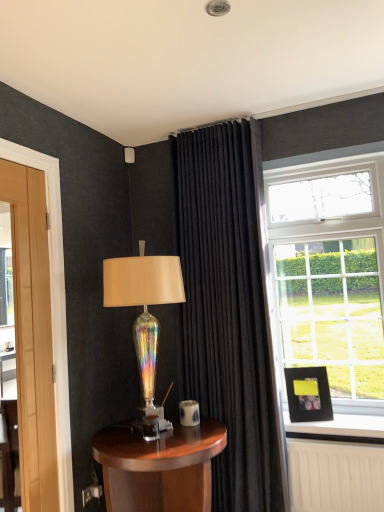
Describe the element at coordinates (159, 467) in the screenshot. The image size is (384, 512). I see `wooden table at lower center` at that location.

Describe the element at coordinates (308, 394) in the screenshot. I see `black matte picture frame at right` at that location.

At what (x,y) coordinates should I click in order to perform the action: click on wooden table at lower center. Please return your answer as a coordinate pair (x, y). Looking at the image, I should click on (159, 467).

Does wooden table at lower center contain black velvet curtain at center?

No, black velvet curtain at center is not a part of wooden table at lower center.

Between wooden table at lower center and black velvet curtain at center, which one has larger width?

Wider between the two is wooden table at lower center.

You are a GUI agent. You are given a task and a screenshot of the screen. Output one action in this format:
    pyautogui.click(x=<x>, y=<y>)
    Task: Click on the curtain behind the wooden table at lower center
    
    Given the screenshot: What is the action you would take?
    pyautogui.click(x=226, y=308)

Locate an element on the screen. Image resolution: width=384 pixels, height=512 pixels. picture frame on the right of wooden table at lower center is located at coordinates (308, 394).

Is wooden table at lower center a part of black matte picture frame at right?

Definitely not — wooden table at lower center is not inside black matte picture frame at right.

From the image's perspective, is black matte picture frame at right positioned above or below wooden table at lower center?

Based on their image positions, black matte picture frame at right is located above wooden table at lower center.

Considering the sizes of objects black matte picture frame at right and wooden table at lower center in the image provided, who is taller, black matte picture frame at right or wooden table at lower center?

With more height is wooden table at lower center.

Between black matte picture frame at right and black velvet curtain at center, which one has smaller width?

black matte picture frame at right is thinner.

Could you tell me if black matte picture frame at right is turned towards black velvet curtain at center?

No, black matte picture frame at right is not turned towards black velvet curtain at center.

Which of these two, black matte picture frame at right or black velvet curtain at center, stands taller?

black velvet curtain at center.

Is iridescent glass lamp at center aimed at black matte picture frame at right?

No, iridescent glass lamp at center does not turn towards black matte picture frame at right.

Which of these two, iridescent glass lamp at center or black matte picture frame at right, stands taller?

With more height is iridescent glass lamp at center.

Is black matte picture frame at right a part of iridescent glass lamp at center?

That's incorrect, black matte picture frame at right is not inside iridescent glass lamp at center.

Looking at this image, from the image's perspective, is black velvet curtain at center over black matte picture frame at right?

Correct, black velvet curtain at center appears higher than black matte picture frame at right in the image.

Considering the relative sizes of black velvet curtain at center and black matte picture frame at right in the image provided, is black velvet curtain at center wider than black matte picture frame at right?

Correct, the width of black velvet curtain at center exceeds that of black matte picture frame at right.

Is black velvet curtain at center in contact with black matte picture frame at right?

black velvet curtain at center and black matte picture frame at right are not in contact.

Is black velvet curtain at center oriented towards black matte picture frame at right?

No, black velvet curtain at center is not facing towards black matte picture frame at right.

Is black velvet curtain at center wider or thinner than wooden table at lower center?

Considering their sizes, black velvet curtain at center looks slimmer than wooden table at lower center.

From a real-world perspective, which is physically below, black velvet curtain at center or wooden table at lower center?

wooden table at lower center.

From the picture: Which of these two, black velvet curtain at center or wooden table at lower center, is bigger?

With larger size is black velvet curtain at center.

Does point (191, 228) appear closer or farther from the camera than point (133, 440)?

Clearly, point (191, 228) is more distant from the camera than point (133, 440).

How many degrees apart are the facing directions of iridescent glass lamp at center and wooden table at lower center?

The facing directions of iridescent glass lamp at center and wooden table at lower center are 0.741 degrees apart.

Is iridescent glass lamp at center outside of wooden table at lower center?

Indeed, iridescent glass lamp at center is completely outside wooden table at lower center.

Is point (158, 418) positioned after point (206, 470)?

Yes, point (158, 418) is behind point (206, 470).

Locate an element on the screen. The height and width of the screenshot is (512, 384). curtain that is above the wooden table at lower center (from the image's perspective) is located at coordinates (226, 308).

What are the coordinates of `table on the left of black matte picture frame at right` in the screenshot? It's located at (159, 467).

Looking at the image, which one is located closer to wooden table at lower center, black matte picture frame at right or iridescent glass lamp at center?

iridescent glass lamp at center.

From the image, which object appears to be farther from wooden table at lower center, black velvet curtain at center or iridescent glass lamp at center?

black velvet curtain at center is further to wooden table at lower center.

Looking at the image, which one is located closer to iridescent glass lamp at center, wooden table at lower center or black matte picture frame at right?

Based on the image, wooden table at lower center appears to be nearer to iridescent glass lamp at center.

From the image, which object appears to be nearer to black velvet curtain at center, iridescent glass lamp at center or wooden table at lower center?

The object closer to black velvet curtain at center is iridescent glass lamp at center.

Considering their positions, is black matte picture frame at right positioned closer to wooden table at lower center than black velvet curtain at center?

Based on the image, black velvet curtain at center appears to be nearer to wooden table at lower center.

Considering their positions, is iridescent glass lamp at center positioned further to black matte picture frame at right than black velvet curtain at center?

Based on the image, iridescent glass lamp at center appears to be further to black matte picture frame at right.

Looking at the image, which one is located closer to iridescent glass lamp at center, black matte picture frame at right or black velvet curtain at center?

black velvet curtain at center is closer to iridescent glass lamp at center.

From the image, which object appears to be farther from wooden table at lower center, black velvet curtain at center or black matte picture frame at right?

Based on the image, black matte picture frame at right appears to be further to wooden table at lower center.

The width and height of the screenshot is (384, 512). In order to click on lamp between black velvet curtain at center and wooden table at lower center in the vertical direction in this screenshot , I will do coord(145,311).

Where is `table between iridescent glass lamp at center and black matte picture frame at right`? The height and width of the screenshot is (512, 384). table between iridescent glass lamp at center and black matte picture frame at right is located at coordinates pos(159,467).

Locate an element on the screen. curtain between wooden table at lower center and black matte picture frame at right is located at coordinates (226, 308).

The image size is (384, 512). I want to click on curtain located between iridescent glass lamp at center and black matte picture frame at right in the left-right direction, so click(x=226, y=308).